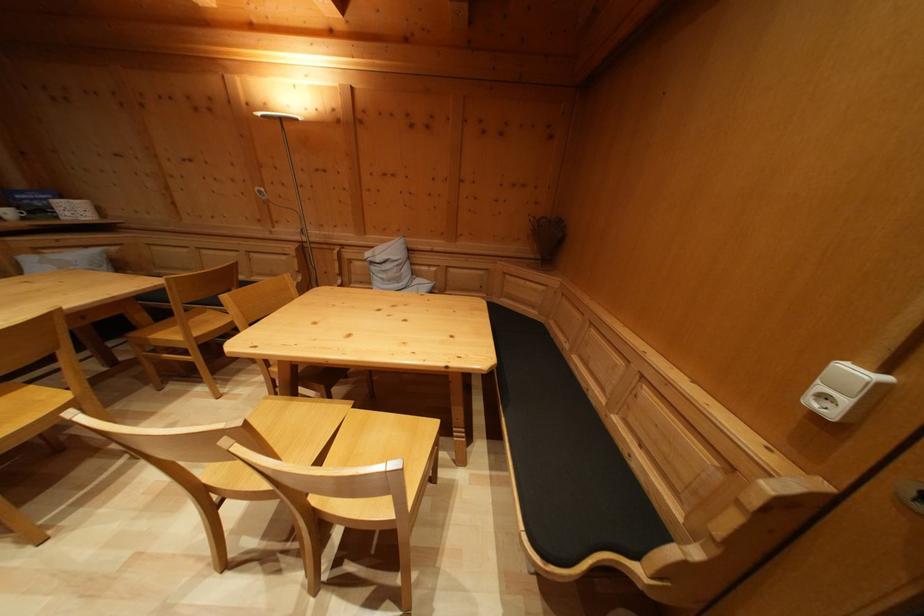
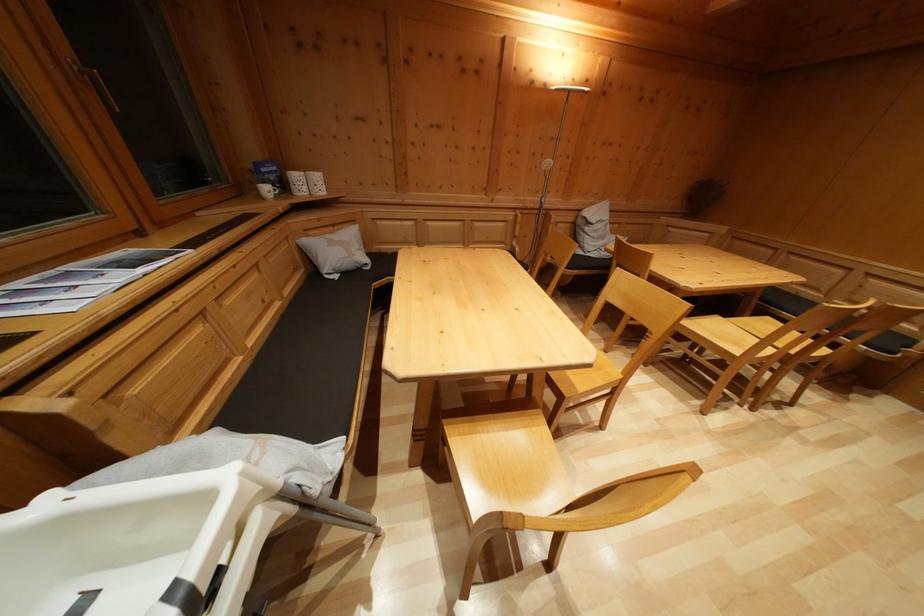
The point at (x=92, y=254) is marked in the first image. Where is the corresponding point in the second image?

(338, 233)